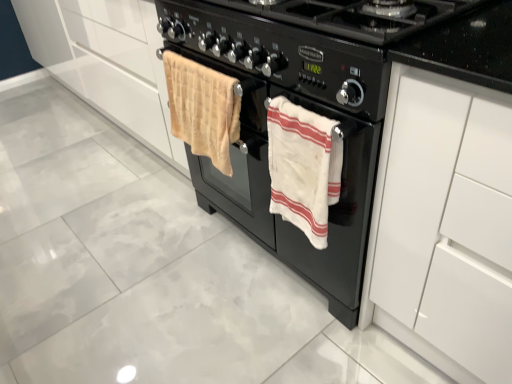
Question: From the image's perspective, relative to black matte gas stove at center, is beige plush towel at center, acting as the 1th beach towel starting from the left, above or below?

Choices:
 (A) below
 (B) above

Answer: (A)

Question: From a real-world perspective, is beige plush towel at center, acting as the 1th beach towel starting from the left, positioned above or below black matte gas stove at center?

Choices:
 (A) below
 (B) above

Answer: (A)

Question: Considering the real-world distances, which object is farthest from the beige plush towel at center, the 2th beach towel viewed from the right?

Choices:
 (A) white glossy cabinet at right
 (B) black matte gas stove at center
 (C) black matte oven at center
 (D) white cotton towel at center, acting as the 1th beach towel starting from the right

Answer: (A)

Question: Which object is positioned closest to the white cotton towel at center, the second beach towel from the left?

Choices:
 (A) black matte oven at center
 (B) white glossy cabinet at right
 (C) black matte gas stove at center
 (D) beige plush towel at center, the 2th beach towel viewed from the right

Answer: (A)